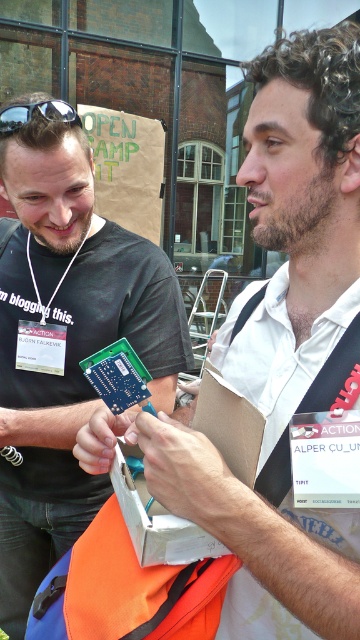
Question: Among these points, which one is farthest from the camera?

Choices:
 (A) [20, 125]
 (B) [12, 508]

Answer: (B)

Question: Does matte black shirt at upper left have a lesser width compared to black plastic goggles at upper left?

Choices:
 (A) no
 (B) yes

Answer: (A)

Question: Does matte black shirt at upper left appear on the right side of black plastic goggles at upper left?

Choices:
 (A) no
 (B) yes

Answer: (B)

Question: Which point is closer to the camera taking this photo?

Choices:
 (A) (29, 400)
 (B) (29, 120)

Answer: (B)

Question: Can you confirm if matte black shirt at upper left is positioned to the left of black plastic goggles at upper left?

Choices:
 (A) no
 (B) yes

Answer: (A)